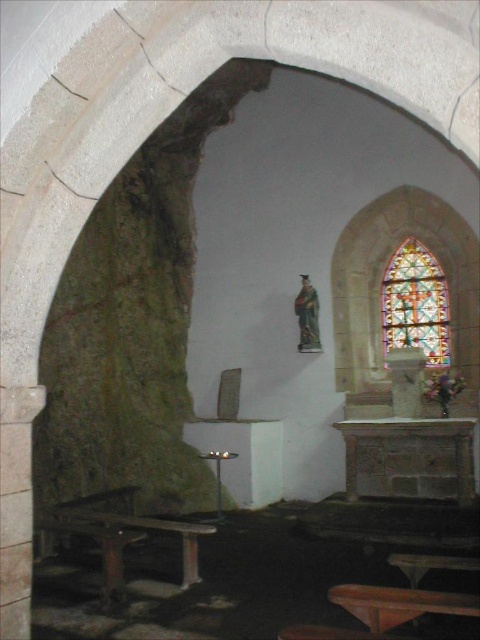
You are a visitor standing at the entrance of the chapel. You see a wooden picnic table at lower left and a stained glass window at right. Which object is taller?

The stained glass window at right is taller than the wooden picnic table at lower left.

You are standing inside the chapel and want to move from the entrance to the stained glass window. The entrance is near point A at coordinates point A is point (72, 506). The stained glass window is near point B at coordinates point B is point (414, 259). Which point should you move towards first to reach the stained glass window?

You should move towards point A at coordinates point A is point (72, 506) first because it is in front of point B at coordinates point B is point (414, 259), meaning it is closer to you.

You are standing at the entrance of the chapel and want to sit down at the wooden picnic table at lower left. Which direction should you move to reach it?

You should move to the lower left direction to reach the wooden picnic table at lower left.